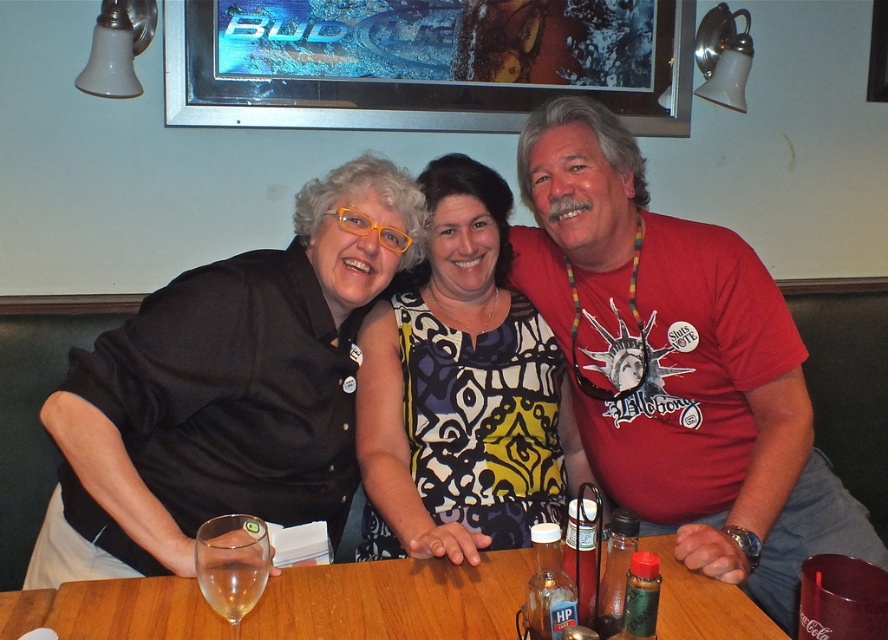
Can you confirm if red matte shirt at center is smaller than wooden table at center?

Actually, red matte shirt at center might be larger than wooden table at center.

Between red matte shirt at center and wooden table at center, which one is positioned lower?

wooden table at center is below.

Does point (719, 291) come in front of point (331, 624)?

That is False.

I want to click on red matte shirt at center, so click(x=678, y=364).

Can you confirm if red matte shirt at center is shorter than clear glass wine glass at lower left?

In fact, red matte shirt at center may be taller than clear glass wine glass at lower left.

Between point (552, 282) and point (258, 579), which one is positioned in front?

Point (258, 579) is more forward.

Locate an element on the screen. red matte shirt at center is located at coordinates (678, 364).

Between wooden table at center and clear glass wine glass at lower left, which one is positioned lower?

wooden table at center is lower down.

Does wooden table at center appear on the right side of clear glass wine glass at lower left?

Yes, wooden table at center is to the right of clear glass wine glass at lower left.

At what (x,y) coordinates should I click in order to perform the action: click on wooden table at center. Please return your answer as a coordinate pair (x, y). Looking at the image, I should click on (394, 600).